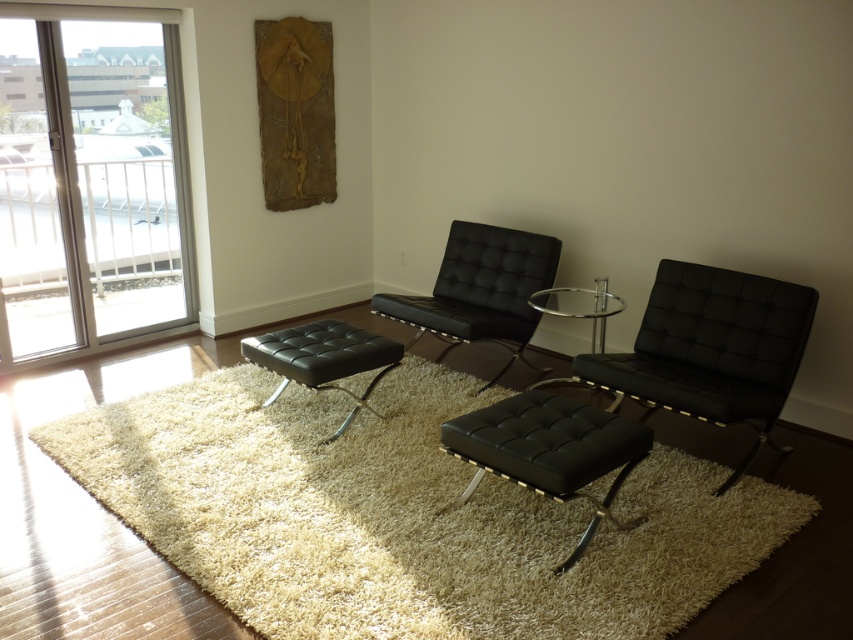
Who is lower down, black leather stool at center or black leather ottoman at center?

black leather stool at center

Between black leather stool at center and black leather ottoman at center, which one is positioned higher?

black leather ottoman at center is higher up.

Is point (583, 458) in front of point (373, 365)?

Yes, point (583, 458) is in front of point (373, 365).

Find the location of a particular element. The height and width of the screenshot is (640, 853). black leather stool at center is located at coordinates (548, 451).

Who is lower down, black leather ottoman at center or transparent glass table at center?

Positioned lower is black leather ottoman at center.

Who is taller, black leather ottoman at center or transparent glass table at center?

Standing taller between the two is black leather ottoman at center.

You are a GUI agent. You are given a task and a screenshot of the screen. Output one action in this format:
    pyautogui.click(x=<x>, y=<y>)
    Task: Click on the black leather ottoman at center
    
    Given the screenshot: What is the action you would take?
    pyautogui.click(x=323, y=356)

Is transparent glass door at left smaller than black leather ottoman at center?

Actually, transparent glass door at left might be larger than black leather ottoman at center.

What do you see at coordinates (91, 184) in the screenshot?
I see `transparent glass door at left` at bounding box center [91, 184].

Is point (125, 291) positioned behind point (341, 324)?

Yes, it is.

Identify the location of transparent glass door at left. (91, 184).